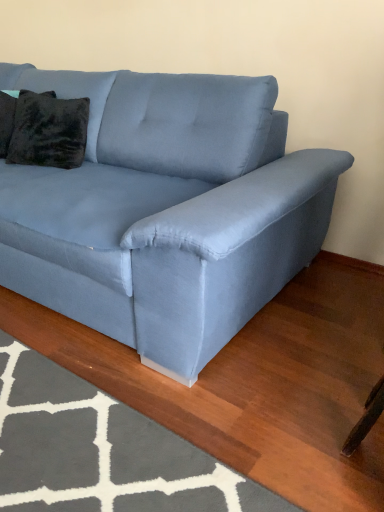
Question: From a real-world perspective, is light blue fabric couch at center physically located above or below velvety black pillow at upper left, placed as the 1th pillow when sorted from left to right?

Choices:
 (A) above
 (B) below

Answer: (B)

Question: From the image's perspective, relative to velvety black pillow at upper left, placed as the 1th pillow when sorted from left to right, is light blue fabric couch at center above or below?

Choices:
 (A) above
 (B) below

Answer: (B)

Question: Which object is positioned closest to the gray textured rug at lower left?

Choices:
 (A) velvety black pillow at upper left, placed as the 1th pillow when sorted from left to right
 (B) velvet dark brown pillow at upper left, which is counted as the 2th pillow, starting from the left
 (C) light blue fabric couch at center

Answer: (C)

Question: Based on their relative distances, which object is nearer to the gray textured rug at lower left?

Choices:
 (A) velvet dark brown pillow at upper left, the 1th pillow when ordered from right to left
 (B) velvety black pillow at upper left, which is the second pillow from right to left
 (C) light blue fabric couch at center

Answer: (C)